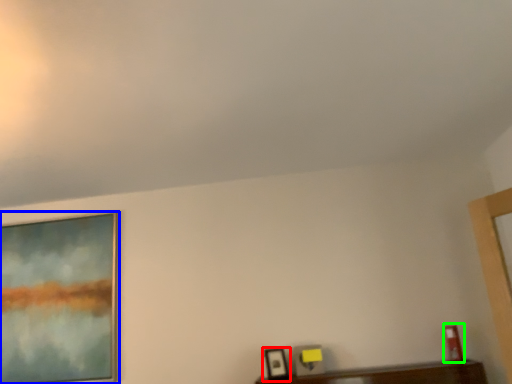
Question: Estimate the real-world distances between objects in this image. Which object is farther from picture frame (highlighted by a red box), picture frame (highlighted by a blue box) or picture frame (highlighted by a green box)?

Choices:
 (A) picture frame
 (B) picture frame

Answer: (A)